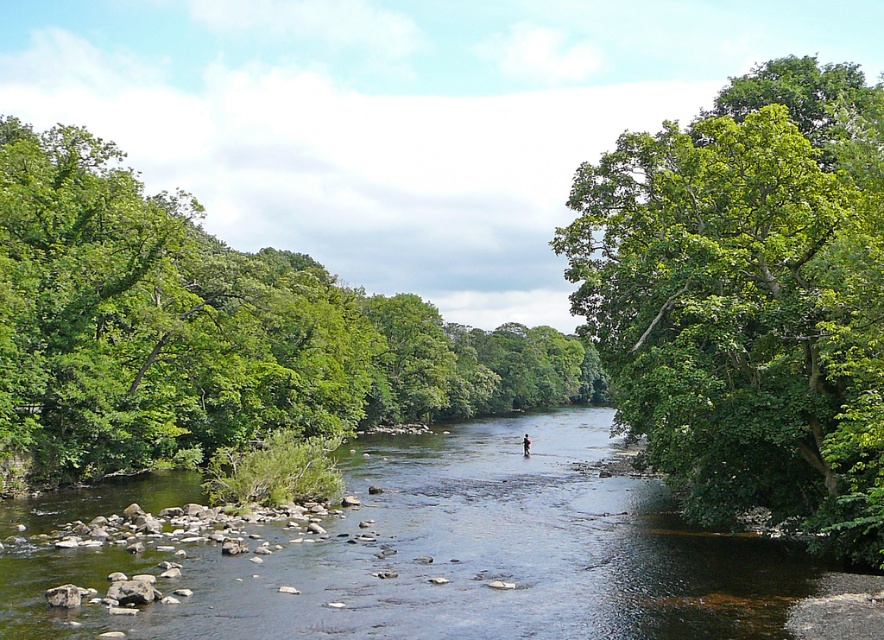
Question: In this image, where is green leafy tree at center located relative to light brown wooden stick at center?

Choices:
 (A) left
 (B) right

Answer: (A)

Question: Estimate the real-world distances between objects in this image. Which object is farther from the green leafy tree at center?

Choices:
 (A) light brown wooden stick at center
 (B) green leafy tree at upper right
 (C) clear water at center

Answer: (A)

Question: Which is farther from the green leafy tree at upper right?

Choices:
 (A) light brown wooden stick at center
 (B) green leafy tree at center

Answer: (B)

Question: Can you confirm if green leafy tree at upper right is positioned below green leafy tree at center?

Choices:
 (A) yes
 (B) no

Answer: (A)

Question: Which point is farther to the camera?

Choices:
 (A) light brown wooden stick at center
 (B) clear water at center

Answer: (A)

Question: Can you confirm if green leafy tree at center is bigger than clear water at center?

Choices:
 (A) no
 (B) yes

Answer: (B)